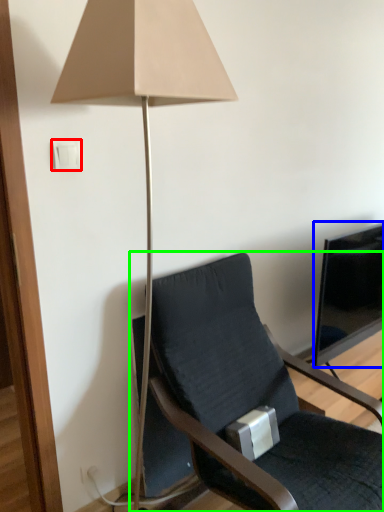
Question: Based on their relative distances, which object is nearer to light switch (highlighted by a red box)? Choose from television (highlighted by a blue box) and chair (highlighted by a green box).

Choices:
 (A) television
 (B) chair

Answer: (B)